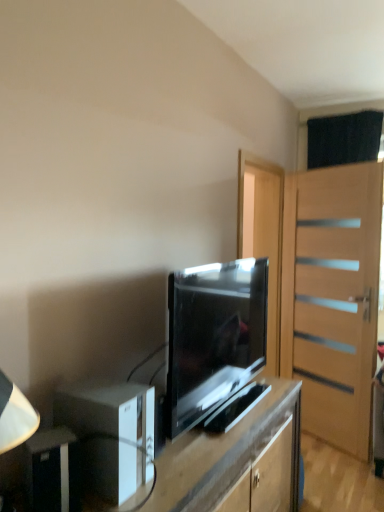
Identify the location of free space in front of light brown wooden door at right. (336, 475).